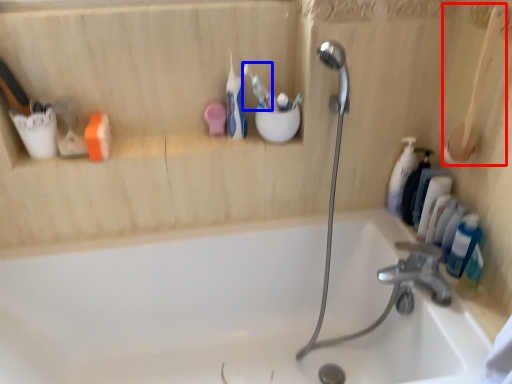
Question: Which object is further to the camera taking this photo, brush (highlighted by a red box) or toothbrush (highlighted by a blue box)?

Choices:
 (A) brush
 (B) toothbrush

Answer: (B)